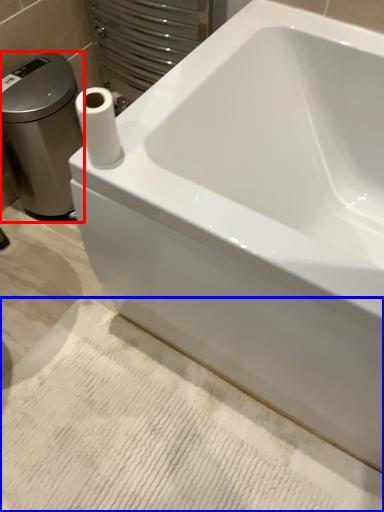
Question: Which object appears closest to the camera in this image, porcelain (highlighted by a red box) or bath mat (highlighted by a blue box)?

Choices:
 (A) porcelain
 (B) bath mat

Answer: (B)